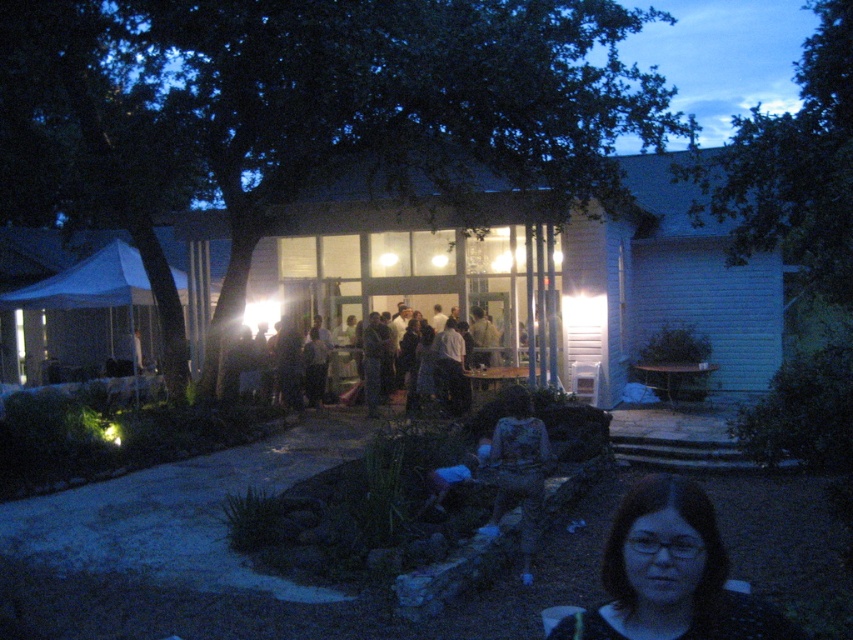
You are a photographer trying to capture a candid shot of the camouflage fabric shirt at center and the brown hair at lower right. Which subject should you focus on first if you want to include both in the frame without moving the camera?

The brown hair at lower right should be focused on first because it is positioned to the left of the camouflage fabric shirt at center, so adjusting the frame to include both would require ensuring the left side is captured first.

You are a photographer trying to capture a candid shot of the dark clothing at center without including the brown hair at lower right in the frame. Based on their positions, is this possible?

The brown hair at lower right is in front of the dark clothing at center, so it would block the view. You cannot capture the dark clothing at center without including the brown hair at lower right in the frame.

You are a photographer trying to capture a candid shot of the people at the event. You notice the brown hair at lower right and the camouflage fabric shirt at center. Which person should you focus on to ensure they are fully visible in your photo without cropping their head?

You should focus on the camouflage fabric shirt at center because the brown hair at lower right is shorter than the camouflage fabric shirt at center, so the camouflage fabric shirt at center will be fully visible without cropping.